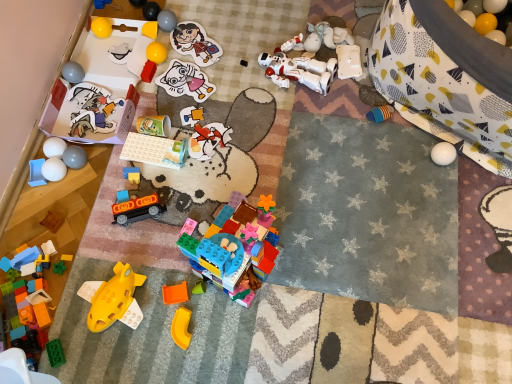
The image size is (512, 384). I want to click on space that is in front of translucent orange plastic toy at center, placed as the 22th toy when sorted from left to right, so click(193, 345).